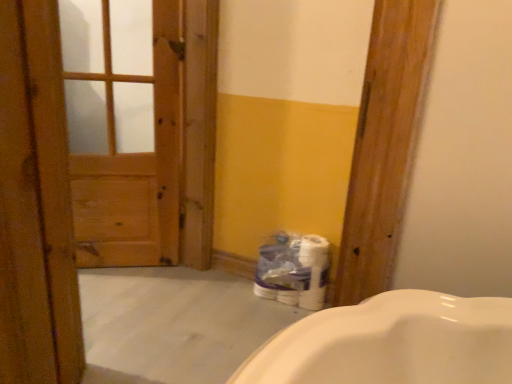
Question: Would you say wooden door at left contains wooden door at left?

Choices:
 (A) yes
 (B) no

Answer: (B)

Question: Is wooden door at left outside of wooden door at left?

Choices:
 (A) no
 (B) yes

Answer: (B)

Question: From a real-world perspective, is wooden door at left on top of wooden door at left?

Choices:
 (A) yes
 (B) no

Answer: (B)

Question: From the image's perspective, is wooden door at left beneath wooden door at left?

Choices:
 (A) yes
 (B) no

Answer: (A)

Question: Does wooden door at left have a lesser height compared to wooden door at left?

Choices:
 (A) yes
 (B) no

Answer: (A)

Question: From the image's perspective, is wooden door at left above or below wooden door at left?

Choices:
 (A) above
 (B) below

Answer: (A)

Question: From their relative heights in the image, would you say wooden door at left is taller or shorter than wooden door at left?

Choices:
 (A) short
 (B) tall

Answer: (B)

Question: Is wooden door at left spatially inside wooden door at left, or outside of it?

Choices:
 (A) outside
 (B) inside

Answer: (A)

Question: Looking at the image, does wooden door at left seem bigger or smaller compared to wooden door at left?

Choices:
 (A) small
 (B) big

Answer: (A)

Question: In terms of height, does wooden door at left look taller or shorter compared to wooden door at left?

Choices:
 (A) short
 (B) tall

Answer: (A)

Question: Considering the positions of wooden door at left and wooden door at left in the image, is wooden door at left wider or thinner than wooden door at left?

Choices:
 (A) thin
 (B) wide

Answer: (B)

Question: From a real-world perspective, is wooden door at left above or below wooden door at left?

Choices:
 (A) below
 (B) above

Answer: (A)

Question: Based on their sizes in the image, would you say wooden door at left is bigger or smaller than wooden door at left?

Choices:
 (A) big
 (B) small

Answer: (A)

Question: Considering the relative positions of wooden door at left and white glossy toilet paper at lower center in the image provided, is wooden door at left to the left or to the right of white glossy toilet paper at lower center?

Choices:
 (A) left
 (B) right

Answer: (A)

Question: Is wooden door at left wider or thinner than white glossy toilet paper at lower center?

Choices:
 (A) thin
 (B) wide

Answer: (A)